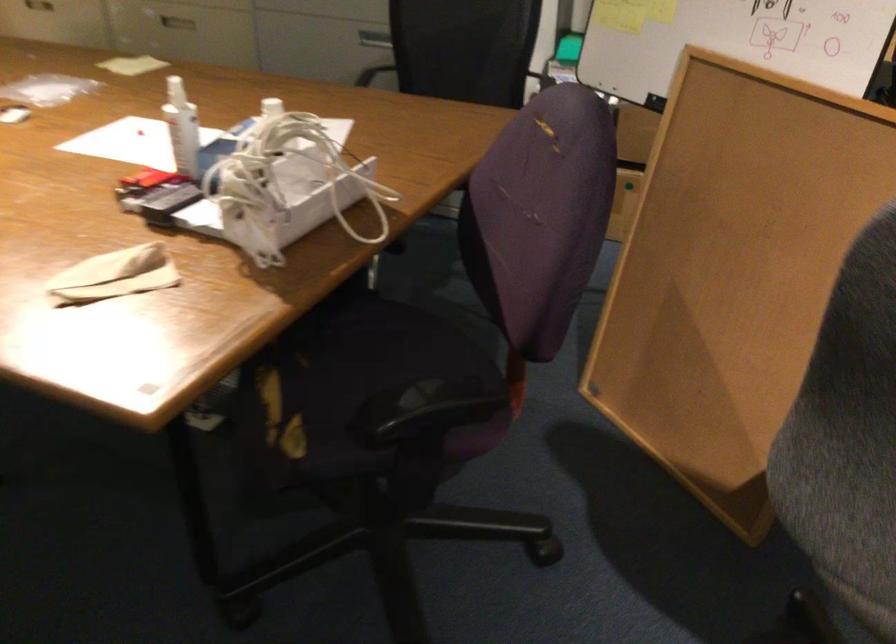
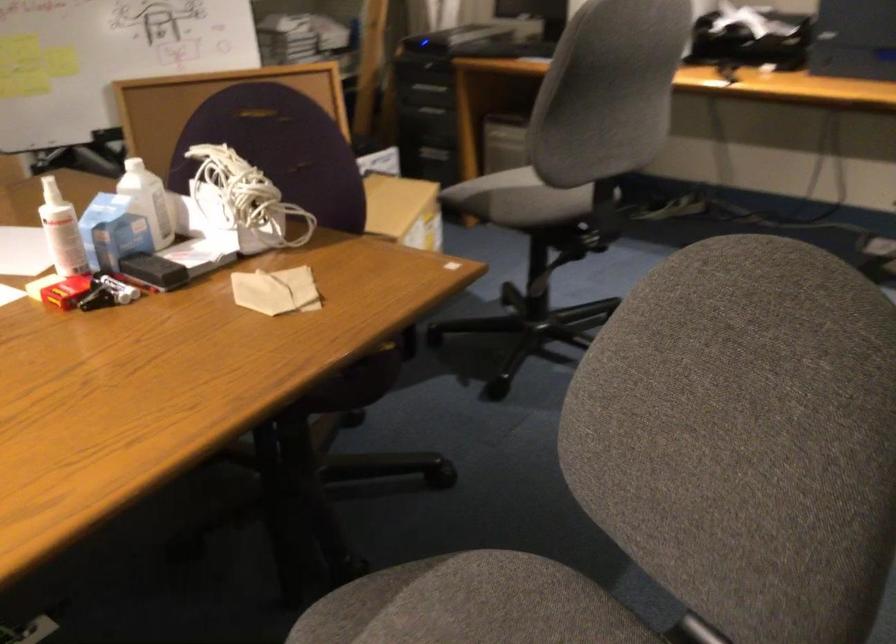
Find the pixel in the second image that matches (144,180) in the first image.

(66, 290)